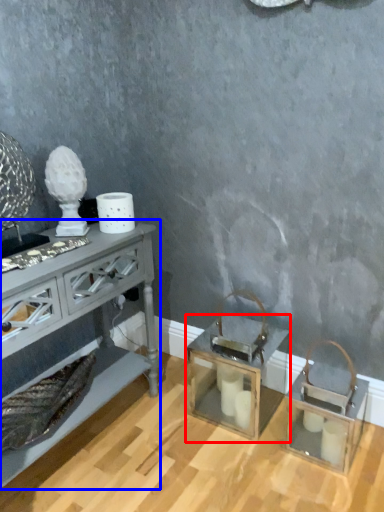
Question: Among these objects, which one is farthest to the camera, table (highlighted by a red box) or table (highlighted by a blue box)?

Choices:
 (A) table
 (B) table

Answer: (A)